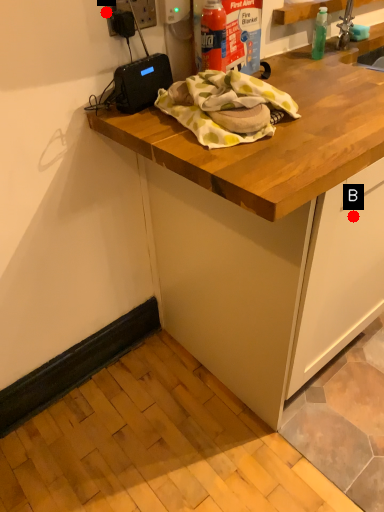
Question: Two points are circled on the image, labeled by A and B beside each circle. Which of the following is the closest to the observer?

Choices:
 (A) A is closer
 (B) B is closer

Answer: (B)